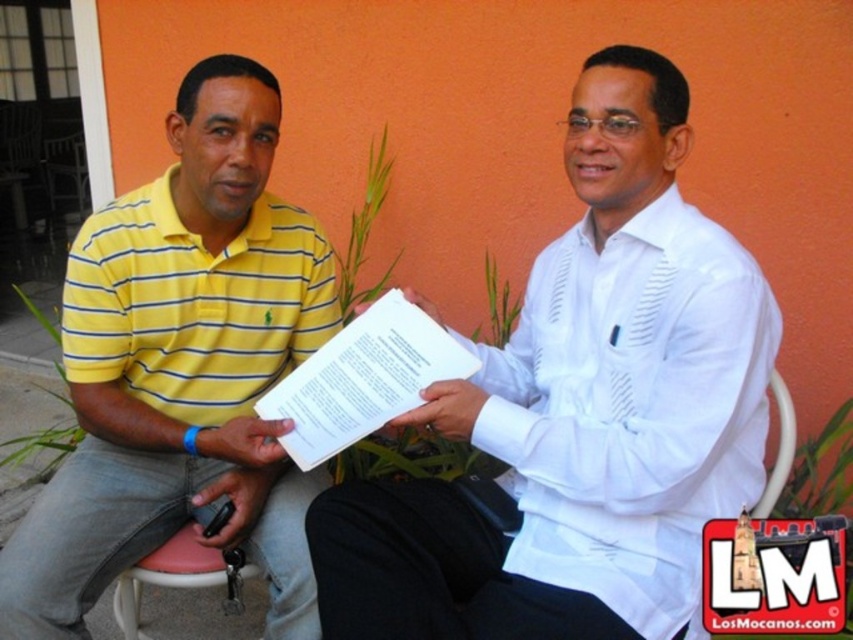
Can you confirm if white textured shirt at center is smaller than white paper at center?

No, white textured shirt at center is not smaller than white paper at center.

Between white textured shirt at center and white paper at center, which one is positioned lower?

white textured shirt at center

Between point (585, 276) and point (381, 304), which one is positioned behind?

The point (585, 276) is more distant.

Find the location of a particular element. Image resolution: width=853 pixels, height=640 pixels. white textured shirt at center is located at coordinates (581, 413).

Can you confirm if yellow striped polo shirt at left is positioned to the right of pink plastic chair at lower left?

Indeed, yellow striped polo shirt at left is positioned on the right side of pink plastic chair at lower left.

Does yellow striped polo shirt at left have a lesser width compared to pink plastic chair at lower left?

Incorrect, yellow striped polo shirt at left's width is not less than pink plastic chair at lower left's.

Between point (132, 368) and point (227, 557), which one is positioned behind?

The point (132, 368) is behind.

Locate an element on the screen. This screenshot has width=853, height=640. yellow striped polo shirt at left is located at coordinates (183, 369).

Between point (694, 380) and point (128, 563), which one is positioned in front?

Point (694, 380) is more forward.

Can you confirm if white textured shirt at center is wider than yellow striped polo shirt at left?

Indeed, white textured shirt at center has a greater width compared to yellow striped polo shirt at left.

Which is behind, point (651, 106) or point (318, 262)?

Positioned behind is point (318, 262).

Find the location of a particular element. white textured shirt at center is located at coordinates (581, 413).